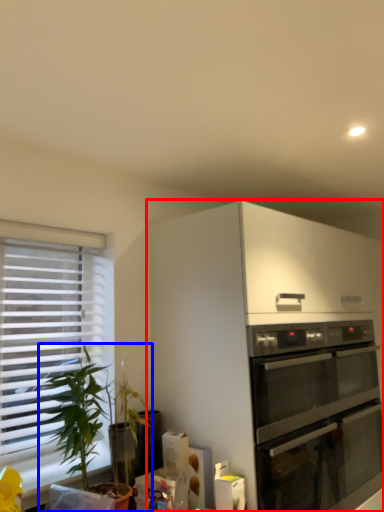
Question: Which object is closer to the camera taking this photo, cabinetry (highlighted by a red box) or houseplant (highlighted by a blue box)?

Choices:
 (A) cabinetry
 (B) houseplant

Answer: (B)